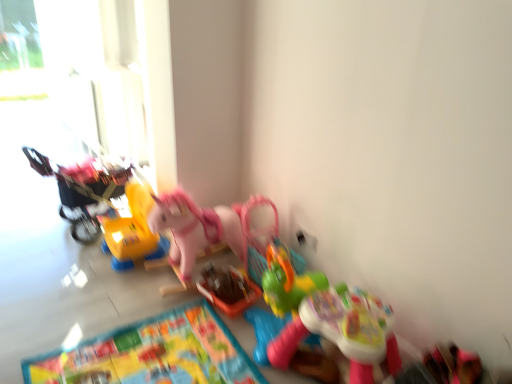
Question: Can you confirm if multicolored fabric mat at lower center is wider than plastic basket at center, arranged as the fifth toy when viewed from the left?

Choices:
 (A) yes
 (B) no

Answer: (A)

Question: Can you confirm if multicolored fabric mat at lower center is positioned to the right of plastic basket at center, arranged as the fifth toy when viewed from the left?

Choices:
 (A) yes
 (B) no

Answer: (B)

Question: Is plastic basket at center, arranged as the fifth toy when viewed from the left, inside multicolored fabric mat at lower center?

Choices:
 (A) yes
 (B) no

Answer: (B)

Question: From a real-world perspective, is multicolored fabric mat at lower center beneath plastic basket at center, arranged as the fifth toy when viewed from the left?

Choices:
 (A) yes
 (B) no

Answer: (A)

Question: Is the position of multicolored fabric mat at lower center more distant than that of plastic basket at center, the 2th toy positioned from the right?

Choices:
 (A) no
 (B) yes

Answer: (A)

Question: Is pink plastic rocking horse at center, the 4th toy in the left-to-right sequence, bigger or smaller than plastic basket at center, arranged as the fifth toy when viewed from the left?

Choices:
 (A) small
 (B) big

Answer: (B)

Question: From a real-world perspective, is pink plastic rocking horse at center, the 4th toy in the left-to-right sequence, physically located above or below plastic basket at center, arranged as the fifth toy when viewed from the left?

Choices:
 (A) above
 (B) below

Answer: (A)

Question: Considering the relative positions of pink plastic rocking horse at center, the 4th toy in the left-to-right sequence, and plastic basket at center, arranged as the fifth toy when viewed from the left, in the image provided, is pink plastic rocking horse at center, the 4th toy in the left-to-right sequence, to the left or to the right of plastic basket at center, arranged as the fifth toy when viewed from the left,?

Choices:
 (A) left
 (B) right

Answer: (A)

Question: Is point (159, 205) positioned closer to the camera than point (202, 274)?

Choices:
 (A) farther
 (B) closer

Answer: (B)

Question: Is yellow plastic toy at center-left, which is the 2th toy from left to right, taller or shorter than plastic basket at center, arranged as the fifth toy when viewed from the left?

Choices:
 (A) tall
 (B) short

Answer: (A)

Question: Is point 138,248 positioned closer to the camera than point 215,266?

Choices:
 (A) farther
 (B) closer

Answer: (B)

Question: In the image, is yellow plastic toy at center-left, which is the 2th toy from left to right, on the left side or the right side of plastic basket at center, the 2th toy positioned from the right?

Choices:
 (A) right
 (B) left

Answer: (B)

Question: From the image's perspective, is yellow plastic toy at center-left, which ranks as the 5th toy in right-to-left order, positioned above or below plastic basket at center, the 2th toy positioned from the right?

Choices:
 (A) above
 (B) below

Answer: (A)

Question: From a real-world perspective, is pink plastic rocking horse at center, the 4th toy in the left-to-right sequence, positioned above or below multicolored fabric mat at lower center?

Choices:
 (A) below
 (B) above

Answer: (B)

Question: Would you say pink plastic rocking horse at center, the third toy in the right-to-left sequence, is to the left or to the right of multicolored fabric mat at lower center in the picture?

Choices:
 (A) right
 (B) left

Answer: (A)